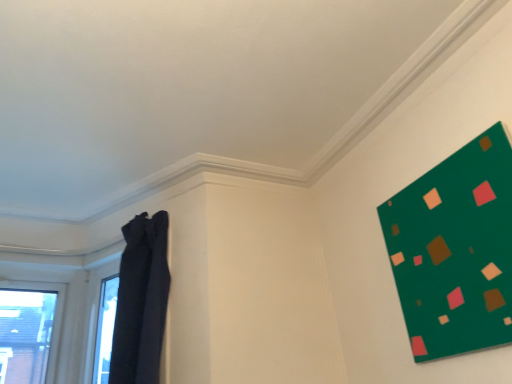
Describe the element at coordinates (455, 250) in the screenshot. I see `green matte board at upper right` at that location.

Find the location of a particular element. This screenshot has width=512, height=384. green matte board at upper right is located at coordinates (455, 250).

What do you see at coordinates (141, 301) in the screenshot? I see `dark fabric curtain at left` at bounding box center [141, 301].

At what (x,y) coordinates should I click in order to perform the action: click on dark fabric curtain at left. Please return your answer as a coordinate pair (x, y). The height and width of the screenshot is (384, 512). Looking at the image, I should click on (141, 301).

Consider the image. What is the approximate height of dark fabric curtain at left?

dark fabric curtain at left is 29.50 inches tall.

Measure the distance between point [141,254] and camera.

Point [141,254] and camera are 1.93 meters apart from each other.

You are a GUI agent. You are given a task and a screenshot of the screen. Output one action in this format:
    pyautogui.click(x=<x>, y=<y>)
    Task: Click on the green matte board at upper right
    This screenshot has height=384, width=512.
    Given the screenshot: What is the action you would take?
    pyautogui.click(x=455, y=250)

Considering the positions of objects dark fabric curtain at left and green matte board at upper right in the image provided, who is more to the left, dark fabric curtain at left or green matte board at upper right?

dark fabric curtain at left.

Considering the positions of objects dark fabric curtain at left and green matte board at upper right in the image provided, who is in front, dark fabric curtain at left or green matte board at upper right?

Positioned in front is green matte board at upper right.

Does point (144, 255) come behind point (440, 326)?

Yes, point (144, 255) is behind point (440, 326).

From the image's perspective, is dark fabric curtain at left on top of green matte board at upper right?

No, from the image's perspective, dark fabric curtain at left is not over green matte board at upper right.

From a real-world perspective, which is physically below, dark fabric curtain at left or green matte board at upper right?

green matte board at upper right.

Looking at this image, considering the relative sizes of dark fabric curtain at left and green matte board at upper right in the image provided, is dark fabric curtain at left thinner than green matte board at upper right?

In fact, dark fabric curtain at left might be wider than green matte board at upper right.

In the scene shown: Can you confirm if dark fabric curtain at left is shorter than green matte board at upper right?

In fact, dark fabric curtain at left may be taller than green matte board at upper right.

Which of these two, dark fabric curtain at left or green matte board at upper right, is smaller?

Smaller between the two is green matte board at upper right.

Is dark fabric curtain at left not within green matte board at upper right?

Absolutely, dark fabric curtain at left is external to green matte board at upper right.

Is dark fabric curtain at left with green matte board at upper right?

dark fabric curtain at left and green matte board at upper right are not in contact.

Is dark fabric curtain at left oriented away from green matte board at upper right?

dark fabric curtain at left does not have its back to green matte board at upper right.

How many degrees apart are the facing directions of dark fabric curtain at left and green matte board at upper right?

There is a 33.5-degree angle between the facing directions of dark fabric curtain at left and green matte board at upper right.

How distant is dark fabric curtain at left from green matte board at upper right?

dark fabric curtain at left and green matte board at upper right are 3.69 feet apart from each other.

Locate an element on the screen. The height and width of the screenshot is (384, 512). curtain on the left side of green matte board at upper right is located at coordinates (141, 301).

Considering the relative positions of green matte board at upper right and dark fabric curtain at left in the image provided, is green matte board at upper right to the left of dark fabric curtain at left from the viewer's perspective?

No, green matte board at upper right is not to the left of dark fabric curtain at left.

From the picture: In the image, is green matte board at upper right positioned in front of or behind dark fabric curtain at left?

Clearly, green matte board at upper right is in front of dark fabric curtain at left.

Which is less distant, (464, 311) or (161, 309)?

Point (464, 311) is closer to the camera than point (161, 309).

From the image's perspective, who appears lower, green matte board at upper right or dark fabric curtain at left?

dark fabric curtain at left appears lower in the image.

From a real-world perspective, which object stands above the other?

dark fabric curtain at left.

Can you confirm if green matte board at upper right is thinner than dark fabric curtain at left?

Yes.

Does green matte board at upper right have a lesser height compared to dark fabric curtain at left?

Indeed, green matte board at upper right has a lesser height compared to dark fabric curtain at left.

Considering the relative sizes of green matte board at upper right and dark fabric curtain at left in the image provided, is green matte board at upper right smaller than dark fabric curtain at left?

Indeed, green matte board at upper right has a smaller size compared to dark fabric curtain at left.

Is green matte board at upper right not inside dark fabric curtain at left?

green matte board at upper right lies outside dark fabric curtain at left's area.

Is green matte board at upper right beside dark fabric curtain at left?

green matte board at upper right and dark fabric curtain at left are not in contact.

Is green matte board at upper right facing towards dark fabric curtain at left?

No, green matte board at upper right is not turned towards dark fabric curtain at left.

How distant is green matte board at upper right from dark fabric curtain at left?

A distance of 1.12 meters exists between green matte board at upper right and dark fabric curtain at left.

Find the location of a particular element. The height and width of the screenshot is (384, 512). bulletin board that is in front of the dark fabric curtain at left is located at coordinates (455, 250).

Identify the location of bulletin board in front of the dark fabric curtain at left. The height and width of the screenshot is (384, 512). (455, 250).

In order to click on curtain above the green matte board at upper right (from a real-world perspective) in this screenshot , I will do `click(141, 301)`.